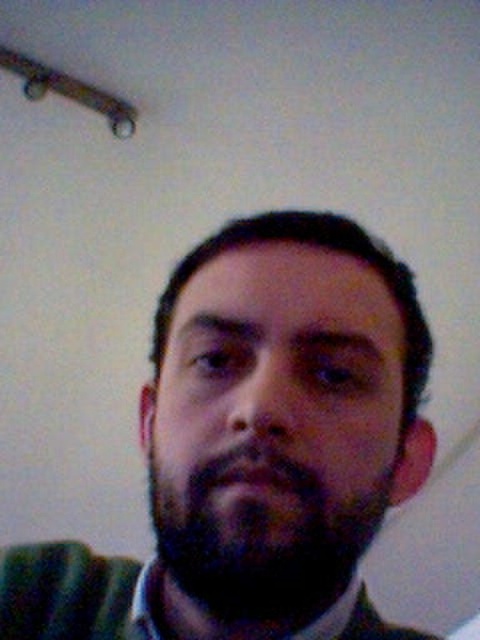
You are an artist trying to sketch this person. Based on the image, which feature is positioned lower on their face between the dark brown hair at center and the dark brown fuzzy beard at center?

The dark brown hair at center is located below the dark brown fuzzy beard at center, so the dark brown hair at center is positioned lower on their face.